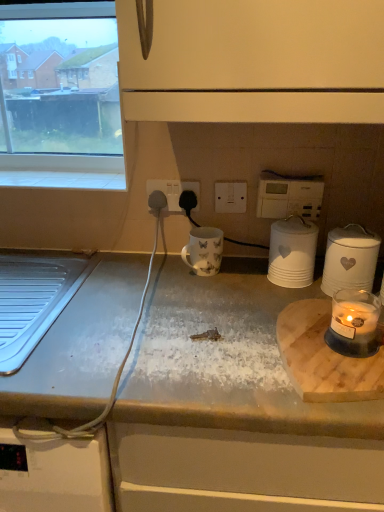
You are a GUI agent. You are given a task and a screenshot of the screen. Output one action in this format:
    pyautogui.click(x=<x>, y=<y>)
    Task: Click on the free space that is in between translucent glass candle at right and white glossy mug at center
    The height and width of the screenshot is (512, 384).
    Given the screenshot: What is the action you would take?
    pyautogui.click(x=241, y=293)